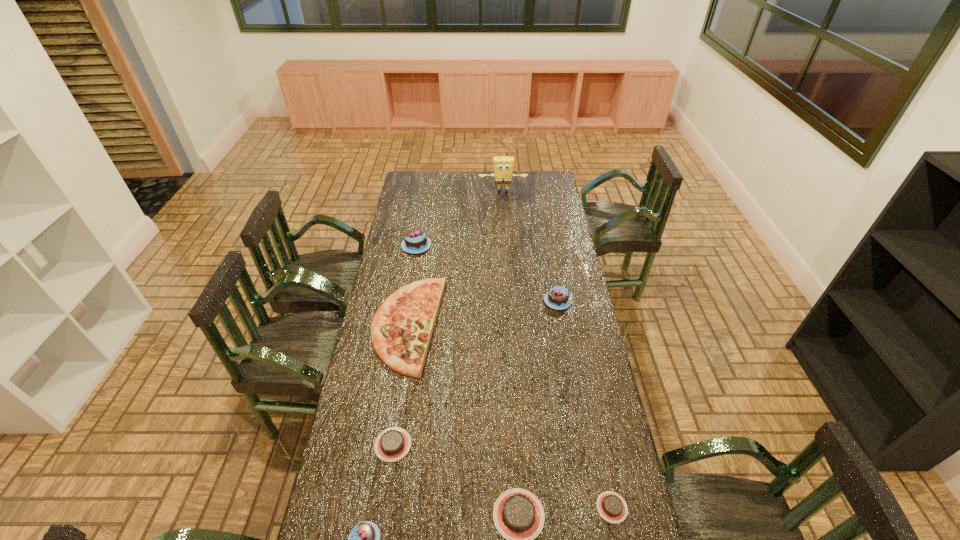
Where is `the rightmost brown chocolate cake`? Image resolution: width=960 pixels, height=540 pixels. the rightmost brown chocolate cake is located at coordinates 611,506.

Find the location of a particular element. blank space located 0.310m on the face of the sponge is located at coordinates (505, 228).

Locate an element on the screen. This screenshot has height=540, width=960. free space located 0.250m on the front of the farthest pink chocolate cake is located at coordinates (409, 291).

The width and height of the screenshot is (960, 540). I want to click on vacant position located on the back of the second farthest pink chocolate cake, so click(547, 240).

The width and height of the screenshot is (960, 540). I want to click on free spot located on the right of the pizza, so click(x=523, y=325).

Locate an element on the screen. This screenshot has height=540, width=960. vacant region located on the back of the fifth farthest object is located at coordinates (406, 356).

You are a GUI agent. You are given a task and a screenshot of the screen. Output one action in this format:
    pyautogui.click(x=<x>, y=<y>)
    Task: Click on the vacant space located 0.200m on the back of the smallest brown chocolate cake
    This screenshot has width=960, height=540.
    Given the screenshot: What is the action you would take?
    pyautogui.click(x=596, y=430)

Where is `object present at the far edge`? The height and width of the screenshot is (540, 960). object present at the far edge is located at coordinates (503, 166).

Find the location of a particular element. The height and width of the screenshot is (540, 960). pizza at the left edge is located at coordinates (401, 330).

This screenshot has width=960, height=540. What are the coordinates of `vacant space at the left edge of the desktop` in the screenshot? It's located at (396, 225).